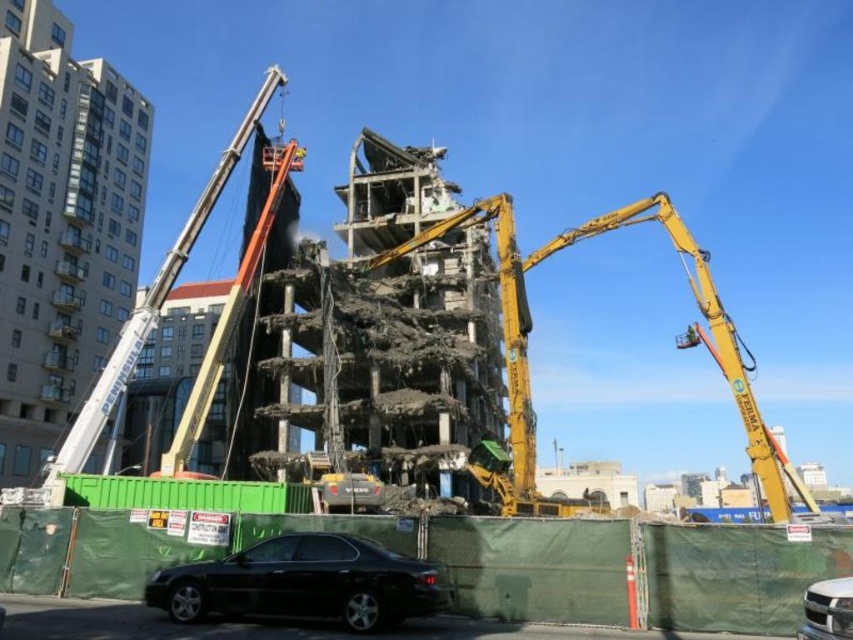
You are a construction worker assessing the demolition site. You need to determine which piece of equipment has a larger arm for handling heavy debris. Based on the scene, which one is bigger between the yellow metallic arm at center and the white metal crane at upper left?

The yellow metallic arm at center is larger in size than the white metal crane at upper left, so the yellow metallic arm at center has a bigger arm for handling heavy debris.

You are a construction worker who needs to determine if the white metal crane at upper left can be moved over the silver metallic suv at lower right without damaging it. Based on their sizes, is this possible?

The white metal crane at upper left is much taller than the silver metallic suv at lower right. Moving the crane over the suv may risk damaging the suv due to the crane being significantly taller.

You are a construction worker standing at the demolition site. You need to determine which of the two points, point [415,576] or point [808,630], is closer to you. Which one is closer?

Point [415,576] is closer to you because it is further to the viewer than point [808,630].